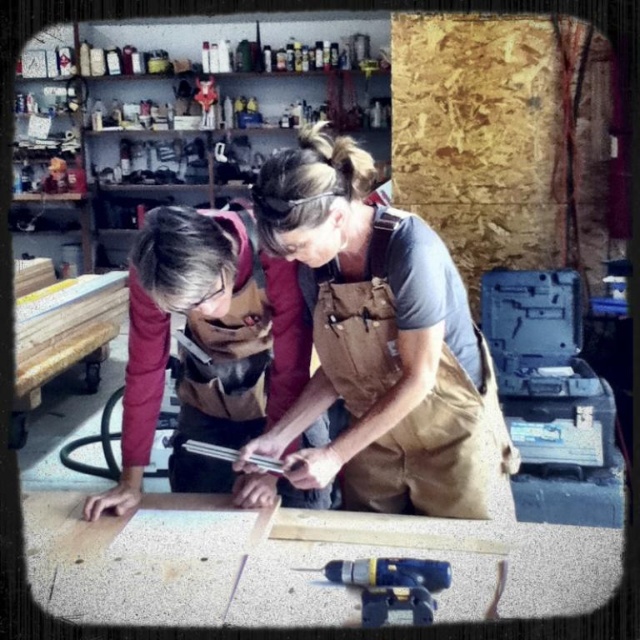
Question: Which object is closer to the camera taking this photo?

Choices:
 (A) brown canvas apron at center
 (B) yellow plastic drill at lower center
 (C) matte brown apron at center

Answer: (B)

Question: In this image, where is brown canvas apron at center located relative to matte brown apron at center?

Choices:
 (A) left
 (B) right

Answer: (B)

Question: Which object is closer to the camera taking this photo?

Choices:
 (A) yellow plastic drill at lower center
 (B) brown canvas apron at center
 (C) matte brown apron at center

Answer: (A)

Question: Which point is farther to the camera?

Choices:
 (A) (368, 600)
 (B) (362, 163)

Answer: (B)

Question: Can you confirm if matte brown apron at center is bigger than yellow plastic drill at lower center?

Choices:
 (A) no
 (B) yes

Answer: (B)

Question: Does brown canvas apron at center appear on the left side of yellow plastic drill at lower center?

Choices:
 (A) yes
 (B) no

Answer: (A)